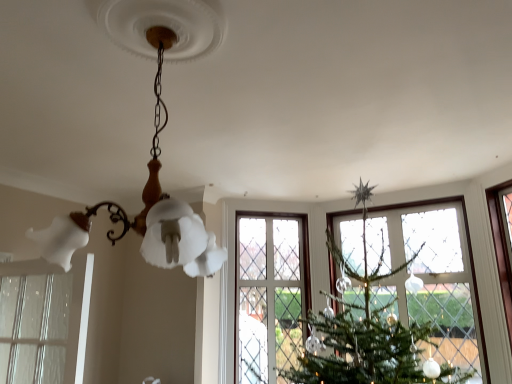
Question: In the image, is matte white glass chandelier at upper center on the left side or the right side of clear glass window at lower left?

Choices:
 (A) right
 (B) left

Answer: (A)

Question: From a real-world perspective, is matte white glass chandelier at upper center physically located above or below clear glass window at lower left?

Choices:
 (A) below
 (B) above

Answer: (B)

Question: Considering the positions of matte white glass chandelier at upper center and clear glass window at lower left in the image, is matte white glass chandelier at upper center taller or shorter than clear glass window at lower left?

Choices:
 (A) tall
 (B) short

Answer: (A)

Question: Is clear glass window at lower left in front of or behind matte white glass chandelier at upper center in the image?

Choices:
 (A) front
 (B) behind

Answer: (B)

Question: Is point (15, 334) closer or farther from the camera than point (157, 200)?

Choices:
 (A) closer
 (B) farther

Answer: (B)

Question: Looking at the image, does clear glass window at lower left seem bigger or smaller compared to matte white glass chandelier at upper center?

Choices:
 (A) big
 (B) small

Answer: (B)

Question: From their relative heights in the image, would you say clear glass window at lower left is taller or shorter than matte white glass chandelier at upper center?

Choices:
 (A) tall
 (B) short

Answer: (B)